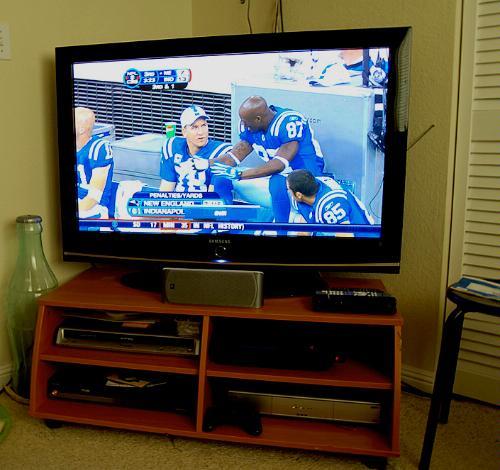
Find the location of a particular element. Image resolution: width=500 pixels, height=470 pixels. brown carpet is located at coordinates (113, 450).